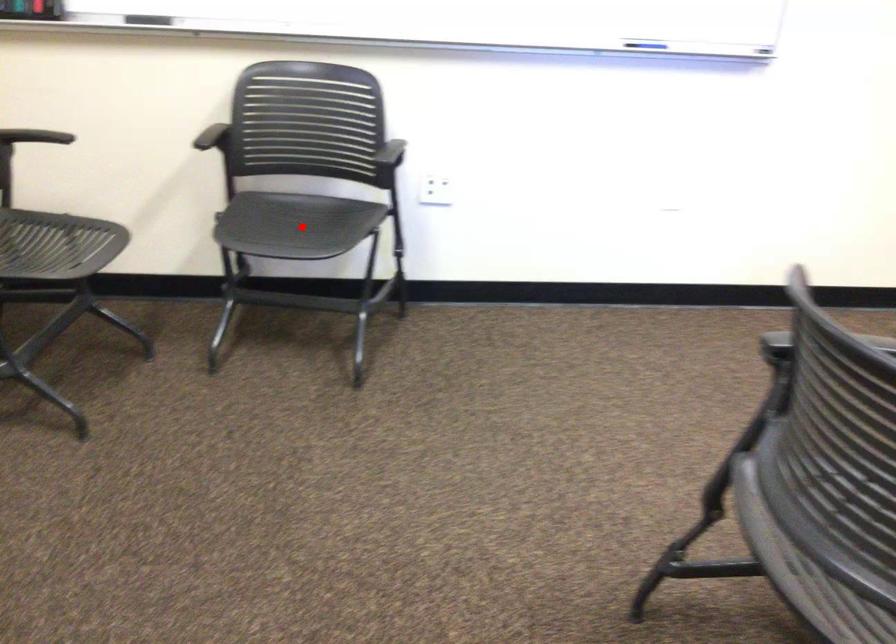
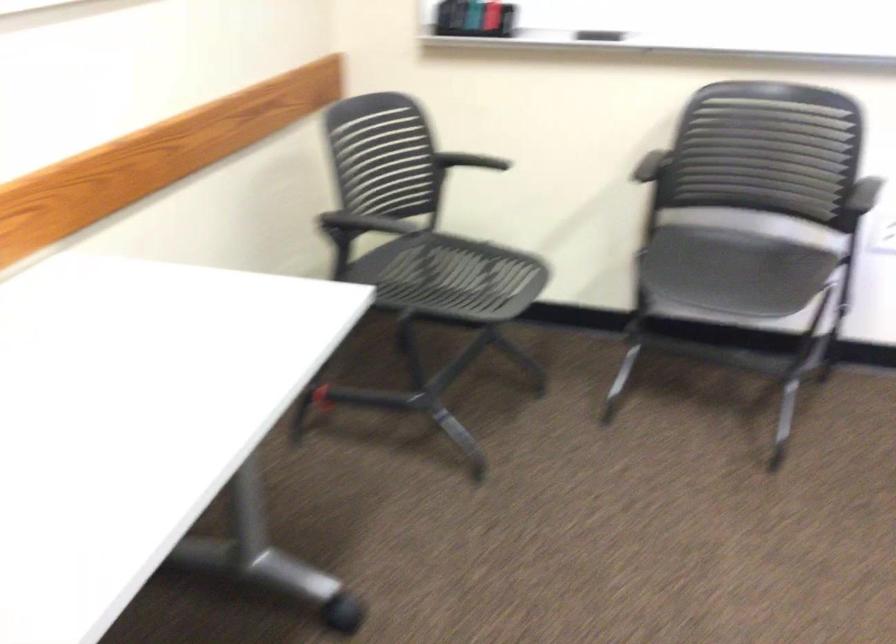
Where in the second image is the point corresponding to the highlighted location from the first image?

(731, 270)